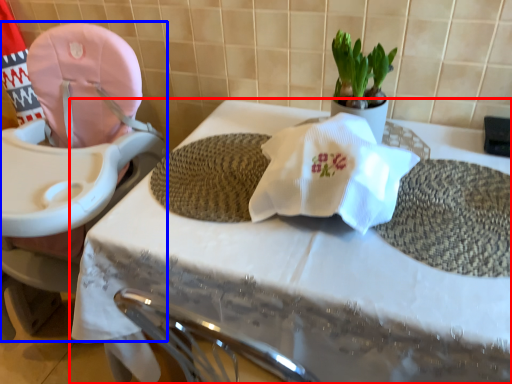
Question: Which object is closer to the camera taking this photo, table (highlighted by a red box) or baby carriage (highlighted by a blue box)?

Choices:
 (A) table
 (B) baby carriage

Answer: (A)